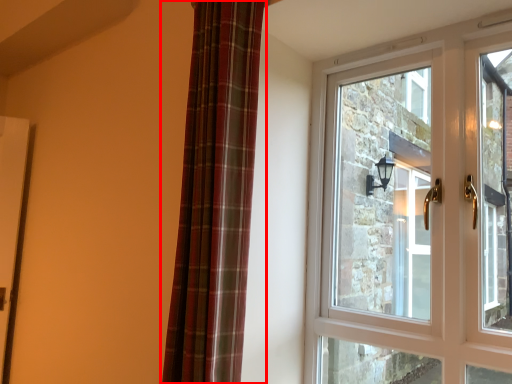
Question: From the image's perspective, considering the relative positions of curtain (annotated by the red box) and window in the image provided, where is curtain (annotated by the red box) located with respect to the staircase?

Choices:
 (A) above
 (B) below

Answer: (A)